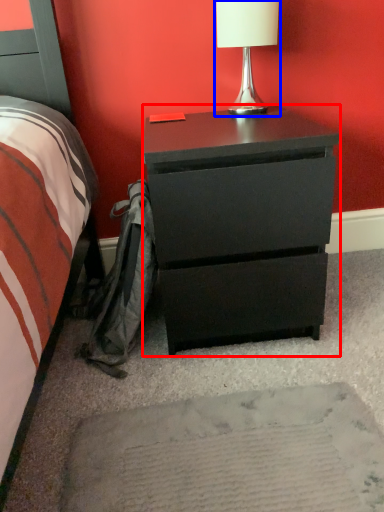
Question: Which object appears closest to the camera in this image, chest of drawers (highlighted by a red box) or table lamp (highlighted by a blue box)?

Choices:
 (A) chest of drawers
 (B) table lamp

Answer: (A)